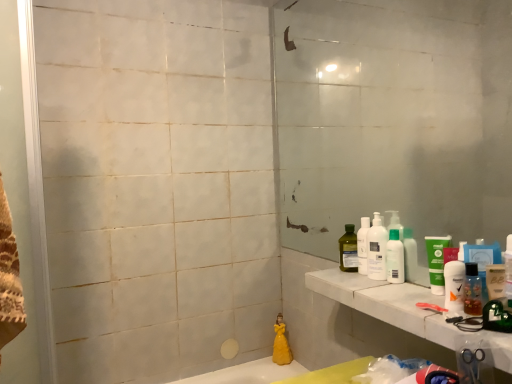
The image size is (512, 384). Identify the location of free space in front of white plastic bottles at right. (411, 290).